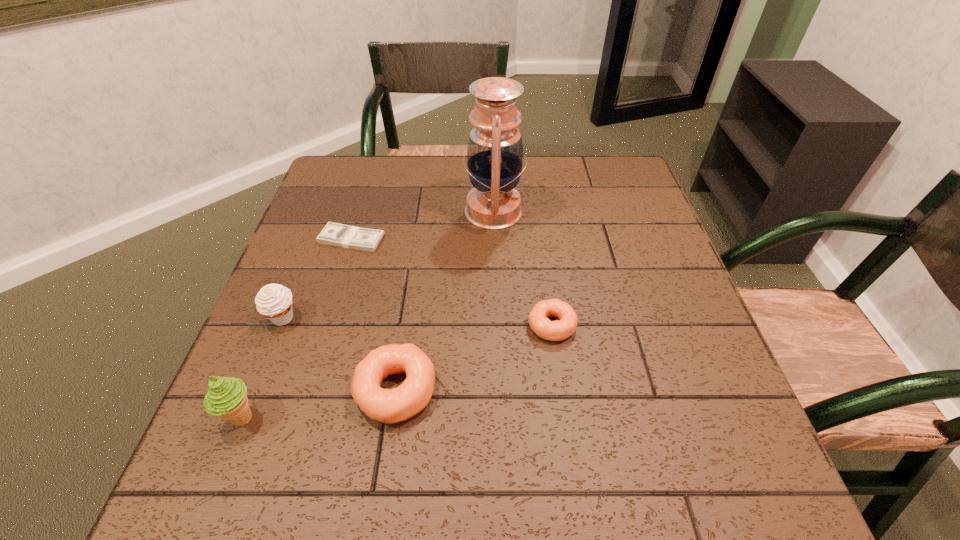
Identify the location of free point between the fourth tallest object and the second tallest object. Image resolution: width=960 pixels, height=540 pixels. (319, 404).

At what (x,y) coordinates should I click in order to perform the action: click on unoccupied position between the oil lamp and the farther doughnut. Please return your answer as a coordinate pair (x, y). The image size is (960, 540). Looking at the image, I should click on pos(522,268).

I want to click on unoccupied area between the farther doughnut and the shortest object, so click(x=451, y=282).

I want to click on vacant point located between the third tallest object and the shortest object, so click(317, 279).

Image resolution: width=960 pixels, height=540 pixels. I want to click on object that is the closest to the shorter doughnut, so click(x=388, y=406).

Identify the location of the fourth closest object to the oil lamp. This screenshot has width=960, height=540. (274, 301).

Where is `free space in the image that satisfies the following two spatial constraints: 1. on the back side of the tallest object; 2. on the right side of the shortest object`? free space in the image that satisfies the following two spatial constraints: 1. on the back side of the tallest object; 2. on the right side of the shortest object is located at coordinates (360, 212).

I want to click on vacant space that satisfies the following two spatial constraints: 1. on the front side of the oil lamp; 2. on the left side of the farther doughnut, so click(497, 325).

Where is `vacant region that satisfies the following two spatial constraints: 1. on the back side of the taller doughnut; 2. on the left side of the tallest object`? The width and height of the screenshot is (960, 540). vacant region that satisfies the following two spatial constraints: 1. on the back side of the taller doughnut; 2. on the left side of the tallest object is located at coordinates (422, 212).